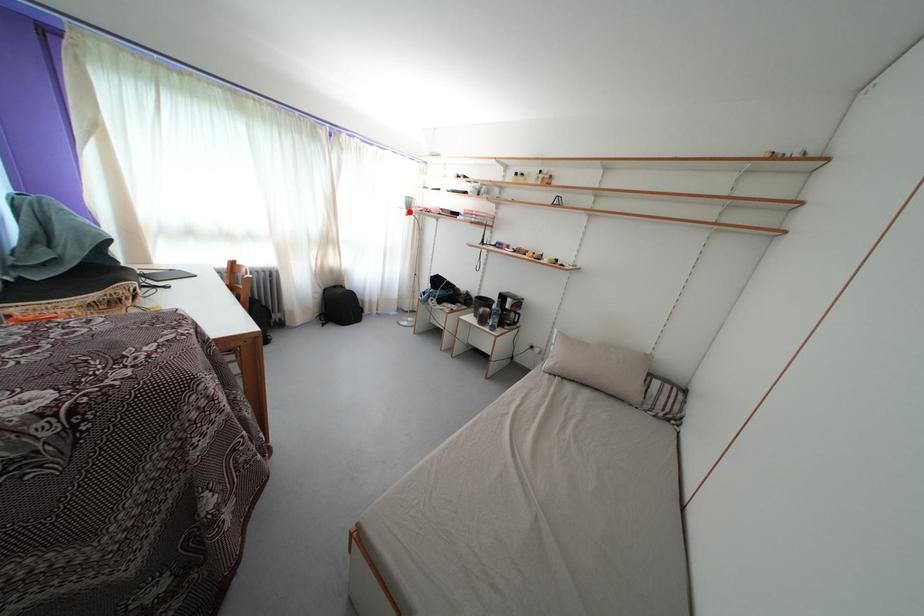
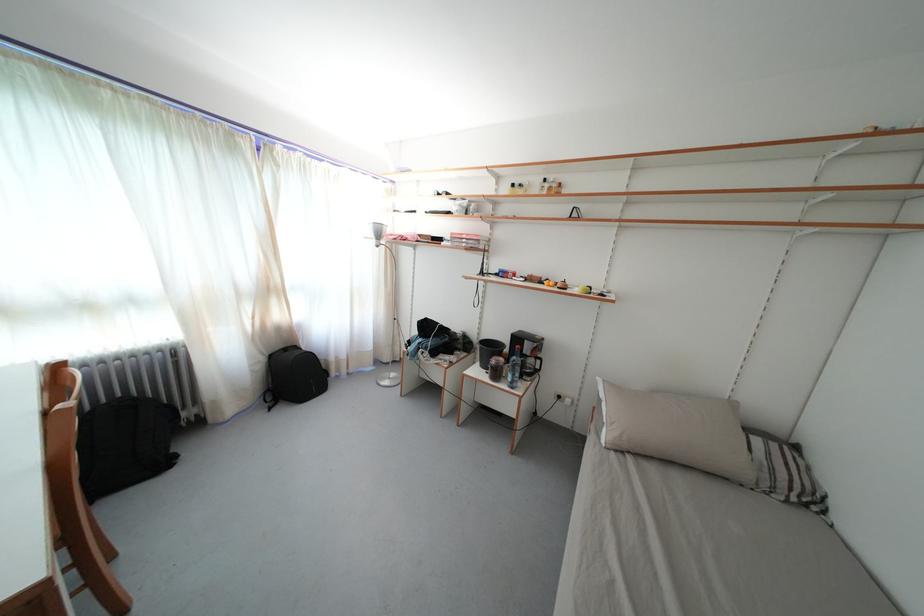
The point at the highlighted location is marked in the first image. Where is the corresponding point in the second image?

(378, 241)